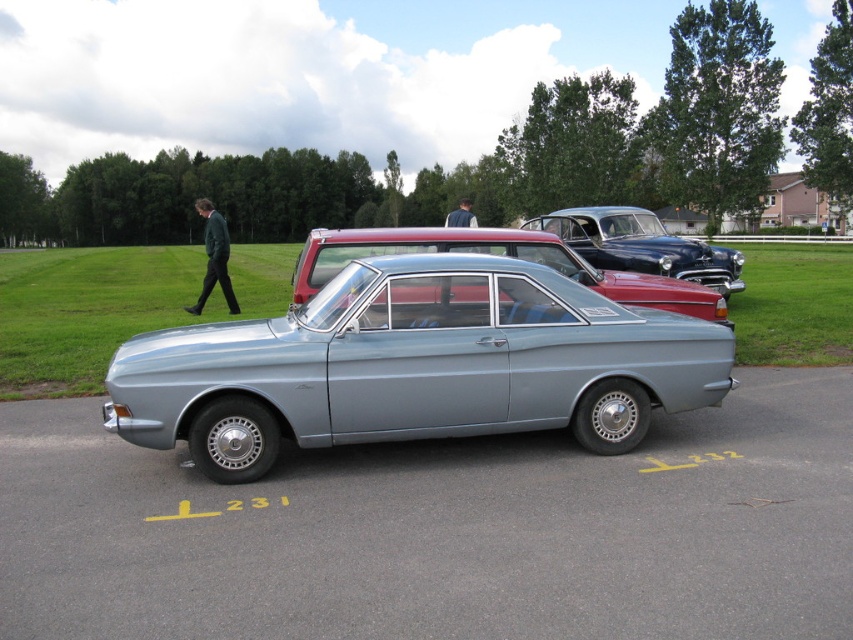
Between point (722, 592) and point (370, 243), which one is positioned behind?

The point (370, 243) is behind.

Who is taller, metallic gray car at center or metallic silver car at center?

metallic silver car at center is taller.

This screenshot has height=640, width=853. What do you see at coordinates (444, 531) in the screenshot?
I see `metallic gray car at center` at bounding box center [444, 531].

Locate an element on the screen. This screenshot has height=640, width=853. metallic gray car at center is located at coordinates (444, 531).

Is shiny blue car at center thinner than green wool coat at upper left?

Yes.

Can you confirm if shiny blue car at center is positioned to the left of green wool coat at upper left?

In fact, shiny blue car at center is to the right of green wool coat at upper left.

Is point (712, 269) less distant than point (222, 248)?

No, it is behind (222, 248).

Identify the location of shiny blue car at center. (641, 244).

Consider the image. Is metallic gray car at center positioned in front of green wool coat at upper left?

That is True.

Is metallic gray car at center smaller than green wool coat at upper left?

Indeed, metallic gray car at center has a smaller size compared to green wool coat at upper left.

Which is in front, point (314, 609) or point (227, 237)?

Positioned in front is point (314, 609).

This screenshot has width=853, height=640. Identify the location of metallic gray car at center. (444, 531).